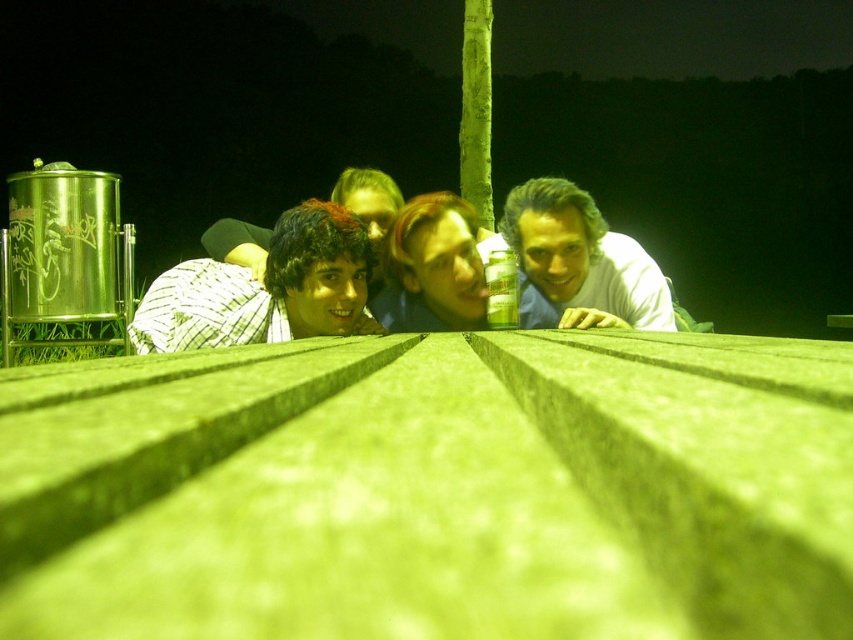
Between plaid shirt at center and smooth skin face at center, which one appears on the left side from the viewer's perspective?

plaid shirt at center

What do you see at coordinates (265, 289) in the screenshot?
I see `plaid shirt at center` at bounding box center [265, 289].

Find the location of `plaid shirt at center`. plaid shirt at center is located at coordinates (265, 289).

Is plaid shirt at center closer to camera compared to matte white shirt at upper right?

Yes, it is.

Is plaid shirt at center further to camera compared to matte white shirt at upper right?

No.

The width and height of the screenshot is (853, 640). What do you see at coordinates (265, 289) in the screenshot?
I see `plaid shirt at center` at bounding box center [265, 289].

Find the location of a particular element. plaid shirt at center is located at coordinates (265, 289).

Can you confirm if smooth skin face at center is positioned above shiny black hair at center?

No, smooth skin face at center is not above shiny black hair at center.

Is smooth skin face at center in front of shiny black hair at center?

Yes, smooth skin face at center is in front of shiny black hair at center.

The width and height of the screenshot is (853, 640). I want to click on smooth skin face at center, so click(432, 268).